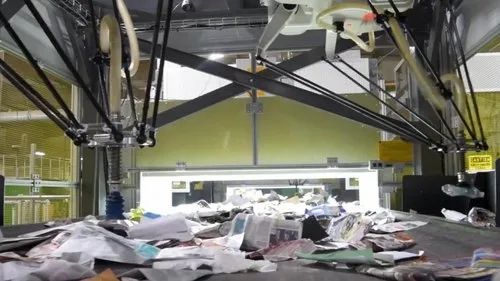
The image size is (500, 281). Identify the location of piece of newspaper. (266, 228).